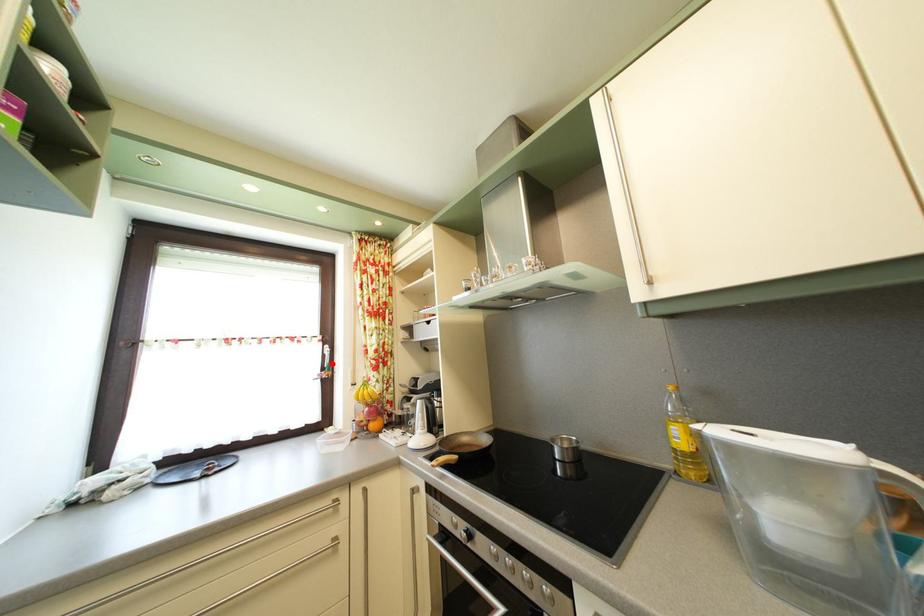
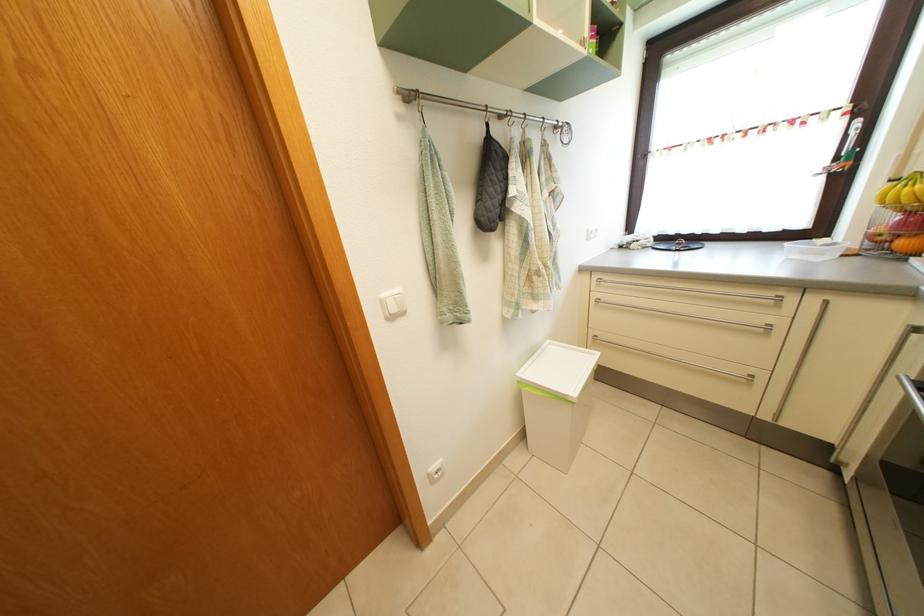
Find the pixel in the second image that matches the highlighted location in the first image.

(853, 146)